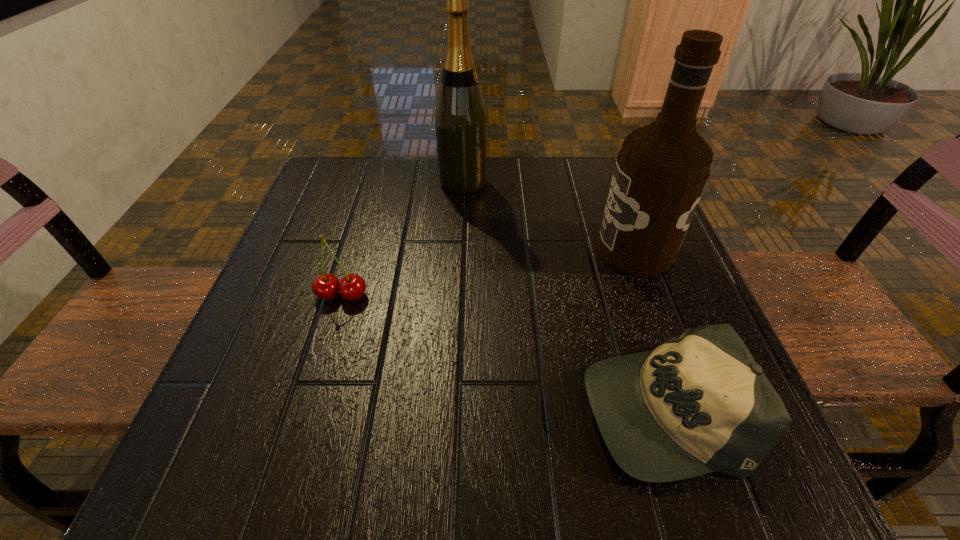
Image resolution: width=960 pixels, height=540 pixels. Find the location of `object positioned at the near right corner`. object positioned at the near right corner is located at coordinates (699, 403).

Locate an element on the screen. Image resolution: width=960 pixels, height=540 pixels. free space at the near edge of the desktop is located at coordinates (428, 488).

In the image, there is a desktop. Where is `vacant area at the left edge`? vacant area at the left edge is located at coordinates (260, 386).

Where is `free space at the right edge of the desktop`? Image resolution: width=960 pixels, height=540 pixels. free space at the right edge of the desktop is located at coordinates (636, 320).

In the image, there is a desktop. Identify the location of free space at the far right corner. (583, 183).

Identify the location of free space between the second farthest object and the baseball cap. This screenshot has width=960, height=540. (648, 328).

This screenshot has width=960, height=540. What are the coordinates of `vacant area that lies between the nearest object and the wine bottle` in the screenshot? It's located at (563, 295).

What are the coordinates of `empty space that is in between the third object from right to left and the shortest object` in the screenshot? It's located at (563, 295).

Find the location of a particular element. free spot between the baseball cap and the wine bottle is located at coordinates (563, 295).

Identify the location of vacant region between the second nearest object and the farthest object. The width and height of the screenshot is (960, 540). (402, 239).